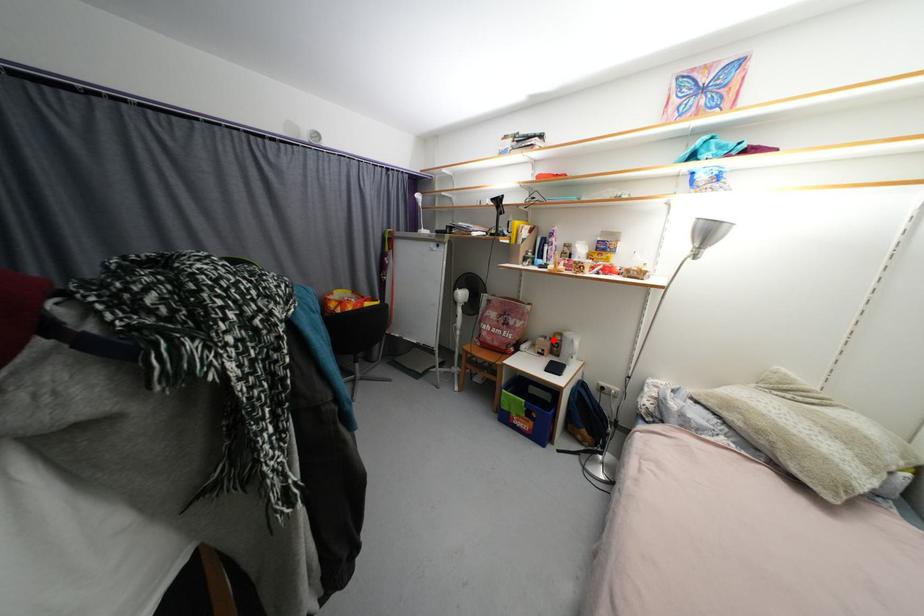
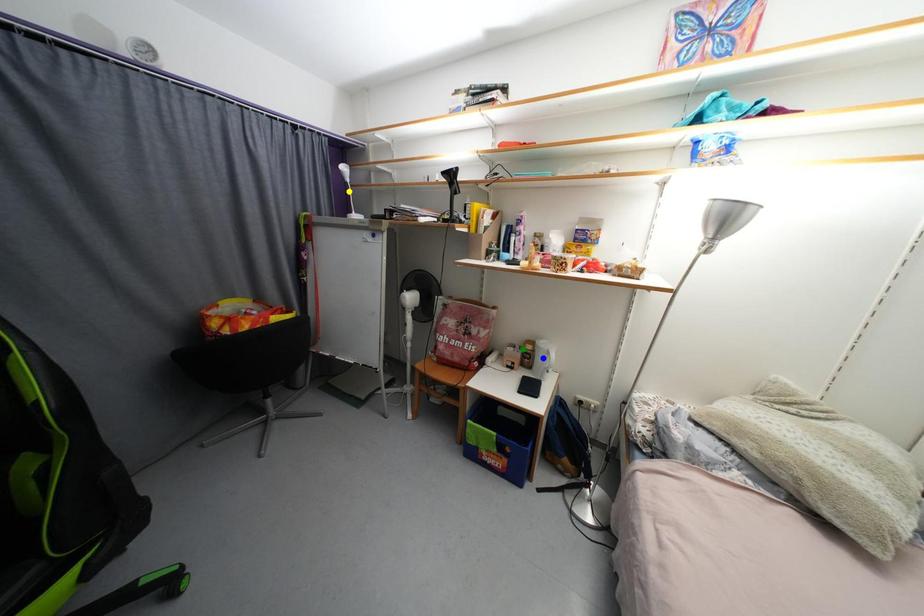
Question: I am providing you with two images of the same scene from different viewpoints. A red point is marked on the first image. You are given multiple points on the second image. Which point in image 2 represents the same 3d spot as the red point in image 1?

Choices:
 (A) green point
 (B) yellow point
 (C) blue point

Answer: (A)